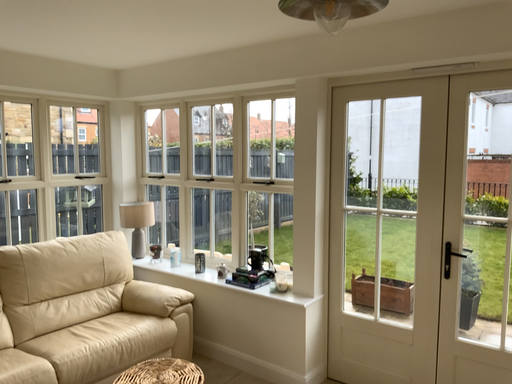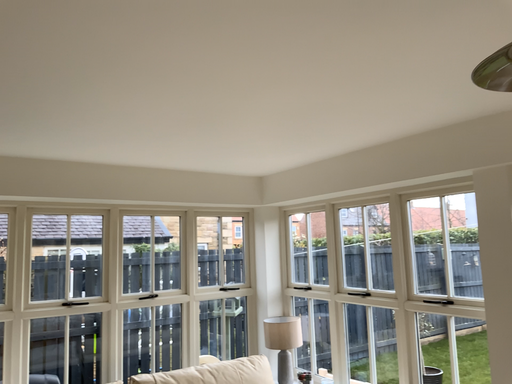
Question: How did the camera likely rotate when shooting the video?

Choices:
 (A) rotated right
 (B) rotated left

Answer: (B)